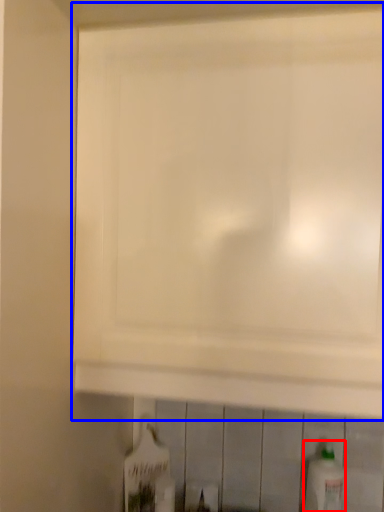
Question: Which object is further to the camera taking this photo, bottle (highlighted by a red box) or cabinetry (highlighted by a blue box)?

Choices:
 (A) bottle
 (B) cabinetry

Answer: (A)